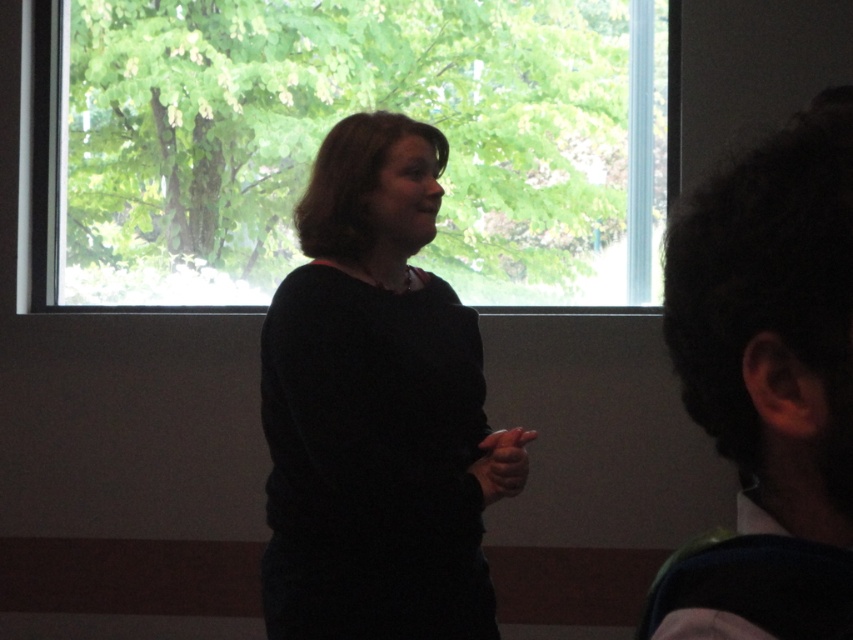
You are an interior designer assessing the lighting in the room. The black matte sweater at center and dark curly hair at right are both in the frame. Which object is larger in size?

The black matte sweater at center has a larger size compared to the dark curly hair at right.

You are an observer in the room where the woman is speaking. You notice the black matte sweater at center and the dark curly hair at right. Which object is located lower in the image?

The black matte sweater at center is positioned under dark curly hair at right, so the black matte sweater at center is lower in the image.